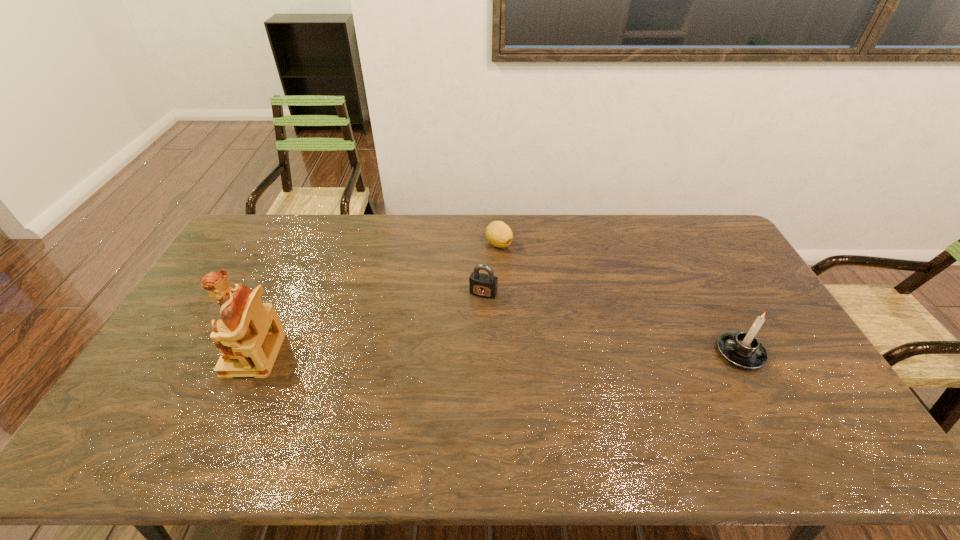
The width and height of the screenshot is (960, 540). In order to click on the tallest object in this screenshot , I will do `click(249, 335)`.

The height and width of the screenshot is (540, 960). Identify the location of figurine. (249, 335).

The image size is (960, 540). I want to click on the rightmost object, so click(x=742, y=349).

I want to click on the second tallest object, so click(x=742, y=349).

The image size is (960, 540). I want to click on the shortest object, so click(499, 234).

I want to click on the farthest object, so click(x=499, y=234).

Identify the location of padlock. (483, 285).

What are the coordinates of `the second farthest object` in the screenshot? It's located at (483, 285).

The height and width of the screenshot is (540, 960). I want to click on vacant space positioned 0.080m on the front-facing side of the tallest object, so click(x=202, y=354).

You are a GUI agent. You are given a task and a screenshot of the screen. Output one action in this format:
    pyautogui.click(x=<x>, y=<y>)
    Task: Click on the vacant area situated 0.150m on the front-facing side of the tallest object
    The width and height of the screenshot is (960, 540).
    Given the screenshot: What is the action you would take?
    pyautogui.click(x=177, y=354)